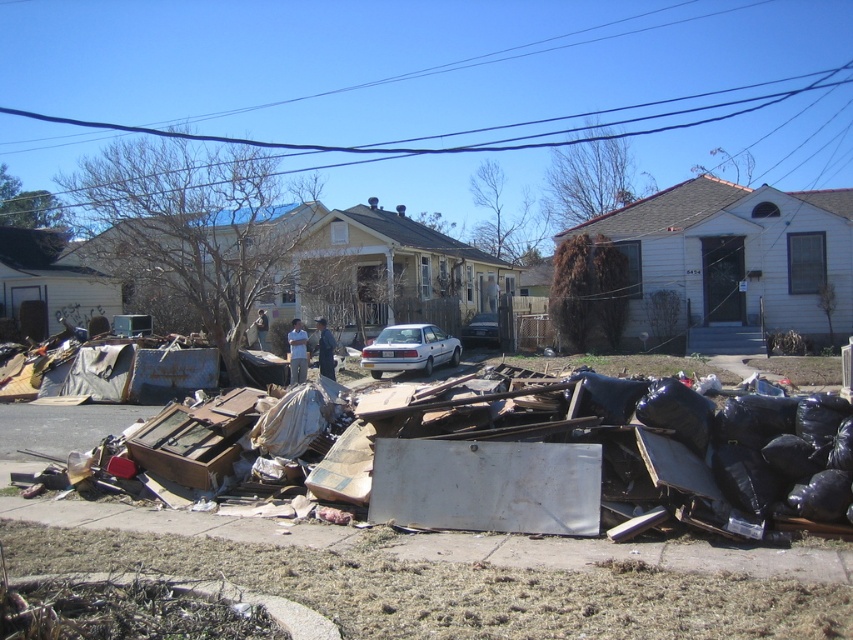
From the picture: Is rusty cardboard boxes at lower center shorter than white matte car at center?

No, rusty cardboard boxes at lower center is not shorter than white matte car at center.

Is rusty cardboard boxes at lower center wider than white matte car at center?

Correct, the width of rusty cardboard boxes at lower center exceeds that of white matte car at center.

Is point (810, 476) positioned before point (480, 317)?

Yes.

This screenshot has height=640, width=853. I want to click on rusty cardboard boxes at lower center, so click(x=595, y=456).

Between black wire at upper center and white matte car at center, which one is positioned higher?

black wire at upper center is higher up.

Is black wire at upper center wider than white matte car at center?

Correct, the width of black wire at upper center exceeds that of white matte car at center.

At what (x,y) coordinates should I click in order to perform the action: click on black wire at upper center. Please return your answer as a coordinate pair (x, y). The width and height of the screenshot is (853, 640). Looking at the image, I should click on (537, 122).

Is black wire at upper center wider than silver metallic sedan at center?

Yes, black wire at upper center is wider than silver metallic sedan at center.

Is point (657, 116) more distant than point (421, 348)?

Yes.

Between point (428, 150) and point (424, 355), which one is positioned behind?

The point (428, 150) is behind.

Locate an element on the screen. Image resolution: width=853 pixels, height=640 pixels. black wire at upper center is located at coordinates (537, 122).